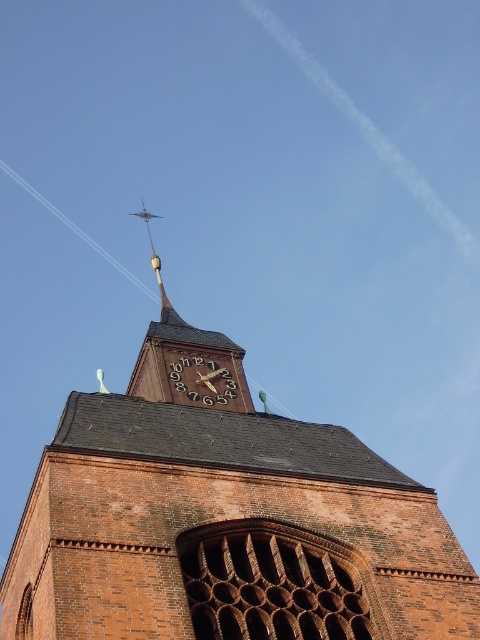
Is brown brick church at center to the left of gold/yellow metal spire at upper center from the viewer's perspective?

Correct, you'll find brown brick church at center to the left of gold/yellow metal spire at upper center.

Is brown brick church at center positioned at the back of gold/yellow metal spire at upper center?

No, it is in front of gold/yellow metal spire at upper center.

Between point (334, 561) and point (160, 278), which one is positioned in front?

Point (334, 561) is more forward.

You are a GUI agent. You are given a task and a screenshot of the screen. Output one action in this format:
    pyautogui.click(x=<x>, y=<y>)
    Task: Click on the brown brick church at center
    Image resolution: width=480 pixels, height=640 pixels.
    Given the screenshot: What is the action you would take?
    pyautogui.click(x=225, y=522)

Which of these two, brown brick church at center or brown wooden clock at center, stands shorter?

With less height is brown wooden clock at center.

What do you see at coordinates (225, 522) in the screenshot? I see `brown brick church at center` at bounding box center [225, 522].

Is point (96, 401) less distant than point (226, 372)?

Yes.

The height and width of the screenshot is (640, 480). I want to click on brown brick church at center, so click(225, 522).

Between brown wooden clock at center and gold/yellow metal spire at upper center, which one has more height?

gold/yellow metal spire at upper center

Who is more distant from viewer, (208, 368) or (156, 264)?

The point (156, 264) is more distant.

The image size is (480, 640). Describe the element at coordinates (204, 380) in the screenshot. I see `brown wooden clock at center` at that location.

Find the location of a particular element. The width and height of the screenshot is (480, 640). brown wooden clock at center is located at coordinates (204, 380).